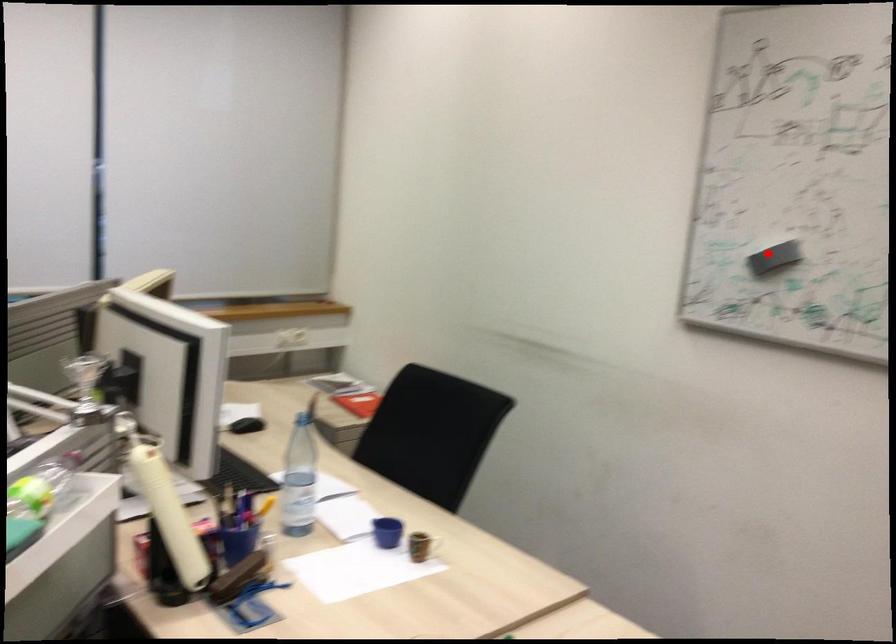
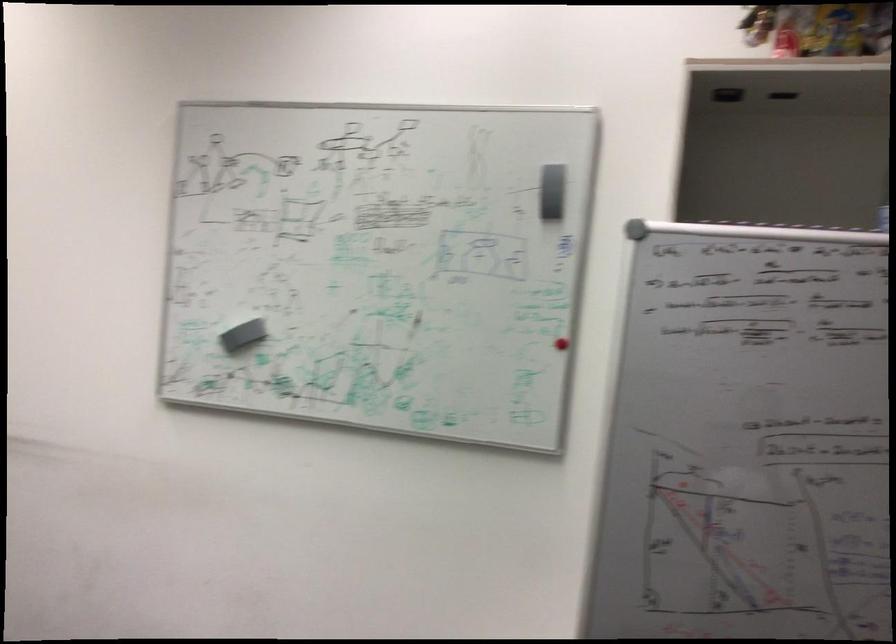
Locate, in the second image, the point that corresponds to the highlighted location in the first image.

(239, 330)